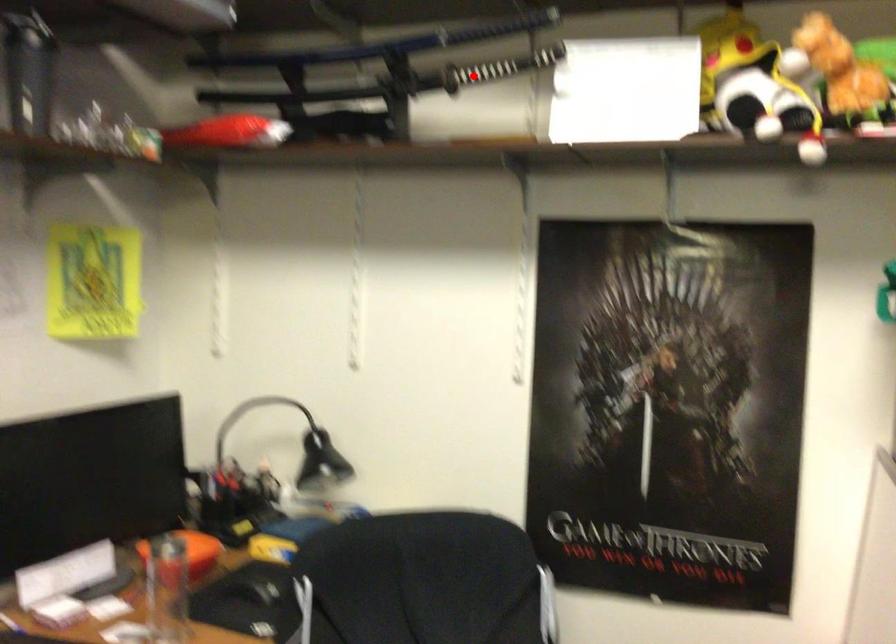
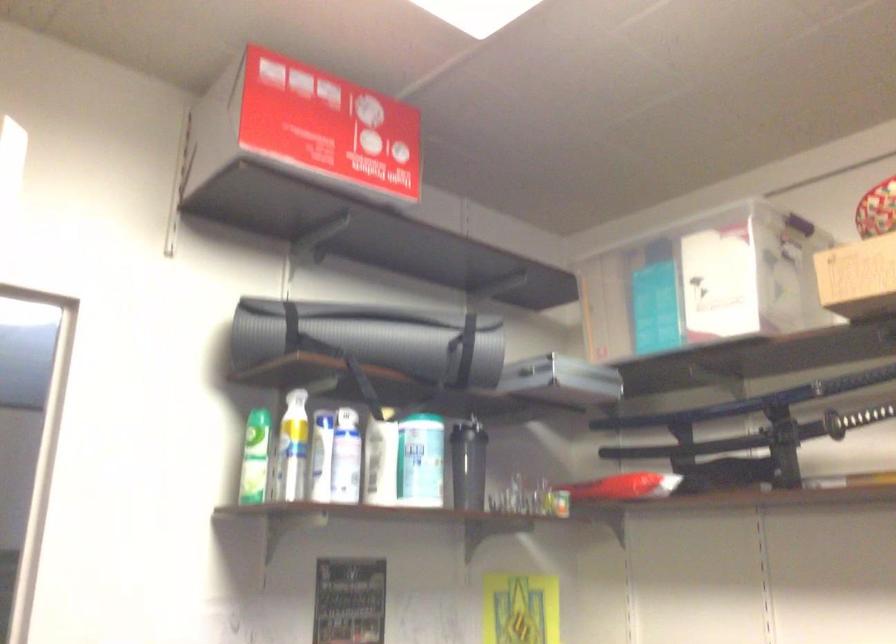
Question: I am providing you with two images of the same scene from different viewpoints. A red point is marked on the first image. Can you still see the location of the red point in image 2?

Choices:
 (A) Yes
 (B) No

Answer: (A)